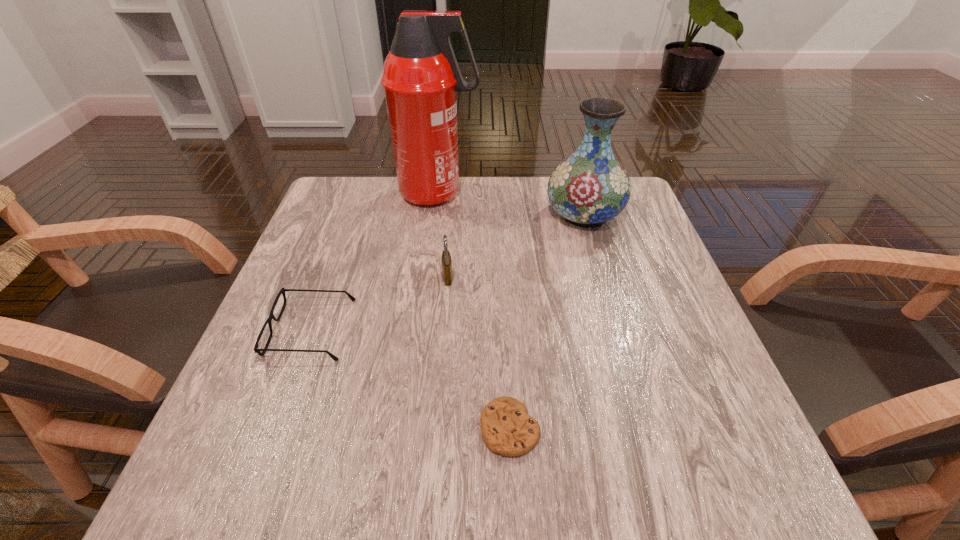
The image size is (960, 540). What are the coordinates of `vacant space positioned 0.360m on the left of the second tallest object` in the screenshot? It's located at (402, 214).

Identify the location of vacant space situated 0.260m on the back of the padlock. (453, 202).

What are the coordinates of `vacant space located 0.130m on the back of the nearest object` in the screenshot? It's located at (505, 339).

Locate an element on the screen. fire extinguisher present at the far edge is located at coordinates (421, 75).

The height and width of the screenshot is (540, 960). Find the location of `vase at the far edge`. vase at the far edge is located at coordinates (588, 188).

The height and width of the screenshot is (540, 960). In order to click on object located at the near edge in this screenshot , I will do `click(506, 428)`.

Find the location of a particular element. Image resolution: width=960 pixels, height=540 pixels. object present at the left edge is located at coordinates (256, 349).

Image resolution: width=960 pixels, height=540 pixels. I want to click on object that is at the right edge, so click(588, 188).

Where is `object that is positioned at the far right corner`? object that is positioned at the far right corner is located at coordinates (588, 188).

Image resolution: width=960 pixels, height=540 pixels. What are the coordinates of `free region at the far edge` in the screenshot? It's located at (406, 213).